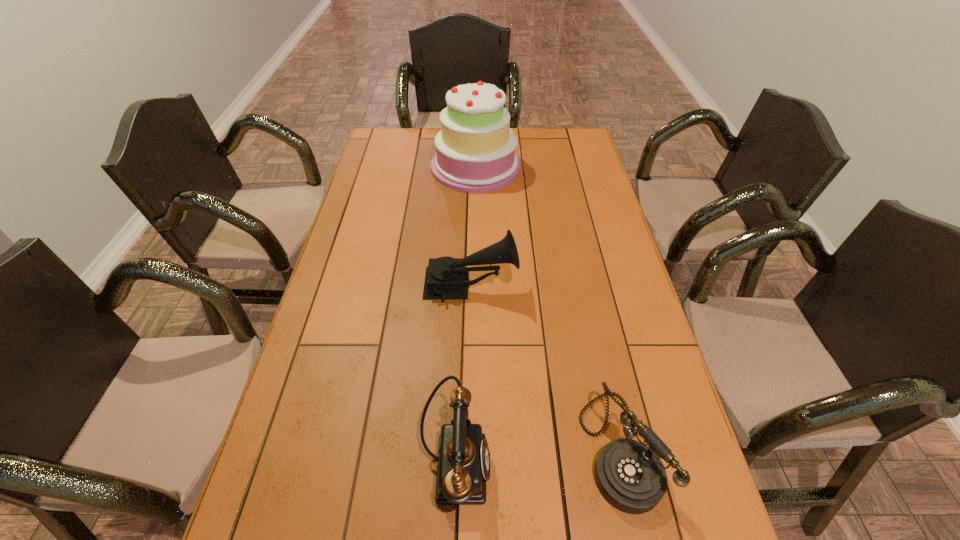
Where is `empty space that is in between the cake and the taller telephone`? empty space that is in between the cake and the taller telephone is located at coordinates (466, 316).

At what (x,y) coordinates should I click in order to perform the action: click on unoccupied position between the taller telephone and the phonograph_record. Please return your answer as a coordinate pair (x, y). This screenshot has width=960, height=540. Looking at the image, I should click on (464, 375).

Where is `vacant point located between the cake and the phonograph_record`? vacant point located between the cake and the phonograph_record is located at coordinates (473, 227).

Identify the location of free space between the taller telephone and the second farthest object. (464, 375).

I want to click on empty space that is in between the left telephone and the shortest object, so click(538, 456).

You are a GUI agent. You are given a task and a screenshot of the screen. Output one action in this format:
    pyautogui.click(x=<x>, y=<y>)
    Task: Click on the free spot between the left telephone and the right telephone
    
    Given the screenshot: What is the action you would take?
    pyautogui.click(x=538, y=456)

You are a GUI agent. You are given a task and a screenshot of the screen. Output one action in this format:
    pyautogui.click(x=<x>, y=<y>)
    Task: Click on the vacant space that's between the rightmost object and the tallest object
    The height and width of the screenshot is (540, 960).
    Given the screenshot: What is the action you would take?
    pyautogui.click(x=547, y=307)

Choose which object is the second nearest neighbor to the right telephone. Please provide its 2D coordinates. Your answer should be formatted as a tuple, i.e. [(x, y)], where the tuple contains the x and y coordinates of a point satisfying the conditions above.

[(446, 277)]

Find the location of a particular element. The width and height of the screenshot is (960, 540). object that is the second closest to the left telephone is located at coordinates (446, 277).

I want to click on vacant position in the image that satisfies the following two spatial constraints: 1. on the front side of the rightmost object; 2. on the left side of the farthest object, so click(x=472, y=448).